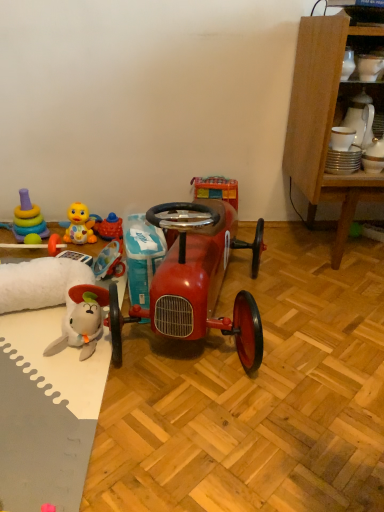
This screenshot has width=384, height=512. What are the coordinates of `stacked plastic rings at left, which ranks as the 5th toy in right-to-left order` in the screenshot? It's located at (27, 220).

What is the approximate width of rubber duck at lower left, the second toy in the left-to-right sequence?

It is 2.54 inches.

Find the location of a particular element. glossy red model car at center is located at coordinates (196, 281).

Where is `yellow rubber duck at left, which is the 3th toy from left to right`? yellow rubber duck at left, which is the 3th toy from left to right is located at coordinates (79, 225).

Measure the distance between white glossy mug at upper center, which is counted as the 5th toy, starting from the left, and camera.

The depth of white glossy mug at upper center, which is counted as the 5th toy, starting from the left, is 1.17 meters.

The width and height of the screenshot is (384, 512). I want to click on wooden cabinet at right, so click(x=328, y=119).

In order to click on stacked plastic rings at left, which ranks as the 5th toy in right-to-left order in this screenshot , I will do `click(27, 220)`.

From a real-world perspective, is stacked plastic rings at left, placed as the first toy when sorted from left to right, located higher than rubber duck at lower left, acting as the 4th toy starting from the right?

Yes, from a real-world perspective, stacked plastic rings at left, placed as the first toy when sorted from left to right, is on top of rubber duck at lower left, acting as the 4th toy starting from the right.

Consider the image. How different are the orientations of stacked plastic rings at left, which ranks as the 5th toy in right-to-left order, and rubber duck at lower left, acting as the 4th toy starting from the right, in degrees?

2.54 degrees.

Considering the positions of points (24, 188) and (30, 239), is point (24, 188) closer to camera compared to point (30, 239)?

That is False.

Is stacked plastic rings at left, placed as the first toy when sorted from left to right, aimed at rubber duck at lower left, the second toy in the left-to-right sequence?

Yes, stacked plastic rings at left, placed as the first toy when sorted from left to right, is oriented towards rubber duck at lower left, the second toy in the left-to-right sequence.

Considering the sizes of objects rubber duck at left, acting as the 2th toy starting from the right, and wooden cabinet at right in the image provided, who is shorter, rubber duck at left, acting as the 2th toy starting from the right, or wooden cabinet at right?

rubber duck at left, acting as the 2th toy starting from the right, is shorter.

Is point (119, 228) less distant than point (348, 211)?

No, (119, 228) is further to viewer.

Is wooden cabinet at right completely or partially inside rubber duck at left, acting as the 2th toy starting from the right?

No, wooden cabinet at right is not surrounded by rubber duck at left, acting as the 2th toy starting from the right.

Which of these two, rubber duck at left, acting as the 2th toy starting from the right, or wooden cabinet at right, is wider?

wooden cabinet at right.

Who is shorter, white glossy mug at upper center, which is counted as the 1th toy, starting from the right, or wooden cabinet at right?

white glossy mug at upper center, which is counted as the 1th toy, starting from the right.

Considering the relative positions of white glossy mug at upper center, which is counted as the 5th toy, starting from the left, and wooden cabinet at right in the image provided, is white glossy mug at upper center, which is counted as the 5th toy, starting from the left, to the right of wooden cabinet at right from the viewer's perspective?

No.

From the image's perspective, is white glossy mug at upper center, which is counted as the 5th toy, starting from the left, located above or below wooden cabinet at right?

Clearly, from the image's perspective, white glossy mug at upper center, which is counted as the 5th toy, starting from the left, is above wooden cabinet at right.

Considering the relative positions of yellow rubber duck at left, which is counted as the third toy, starting from the right, and rubber duck at lower left, acting as the 4th toy starting from the right, in the image provided, is yellow rubber duck at left, which is counted as the third toy, starting from the right, in front of rubber duck at lower left, acting as the 4th toy starting from the right,?

Yes, it is in front of rubber duck at lower left, acting as the 4th toy starting from the right.

From the image's perspective, which one is positioned higher, yellow rubber duck at left, which is the 3th toy from left to right, or rubber duck at lower left, acting as the 4th toy starting from the right?

yellow rubber duck at left, which is the 3th toy from left to right, appears higher in the image.

Looking at this image, is yellow rubber duck at left, which is counted as the third toy, starting from the right, bigger than rubber duck at lower left, acting as the 4th toy starting from the right?

Indeed, yellow rubber duck at left, which is counted as the third toy, starting from the right, has a larger size compared to rubber duck at lower left, acting as the 4th toy starting from the right.

From a real-world perspective, which is physically below, yellow rubber duck at left, which is the 3th toy from left to right, or rubber duck at lower left, acting as the 4th toy starting from the right?

From a 3D spatial view, rubber duck at lower left, acting as the 4th toy starting from the right, is below.

Is point (74, 217) in front of point (120, 229)?

No, (74, 217) is further to viewer.

Could you tell me if yellow rubber duck at left, which is the 3th toy from left to right, is turned towards rubber duck at left, which is the 4th toy from left to right?

No, yellow rubber duck at left, which is the 3th toy from left to right, is not turned towards rubber duck at left, which is the 4th toy from left to right.

From a real-world perspective, which is physically above, yellow rubber duck at left, which is counted as the third toy, starting from the right, or rubber duck at left, which is the 4th toy from left to right?

In real-world perspective, yellow rubber duck at left, which is counted as the third toy, starting from the right, is above.

From the picture: Which is in front, wooden cabinet at right or rubber duck at lower left, acting as the 4th toy starting from the right?

wooden cabinet at right.

Is wooden cabinet at right positioned beyond the bounds of rubber duck at lower left, acting as the 4th toy starting from the right?

wooden cabinet at right lies outside rubber duck at lower left, acting as the 4th toy starting from the right,'s area.

Does wooden cabinet at right have a lesser height compared to rubber duck at lower left, the second toy in the left-to-right sequence?

No, wooden cabinet at right is not shorter than rubber duck at lower left, the second toy in the left-to-right sequence.

Can you confirm if wooden cabinet at right is smaller than rubber duck at lower left, the second toy in the left-to-right sequence?

No, wooden cabinet at right is not smaller than rubber duck at lower left, the second toy in the left-to-right sequence.

Looking at this image, is white glossy mug at upper center, which is counted as the 5th toy, starting from the left, not within rubber duck at left, which is the 4th toy from left to right?

Yes, white glossy mug at upper center, which is counted as the 5th toy, starting from the left, is not within rubber duck at left, which is the 4th toy from left to right.

Is white glossy mug at upper center, which is counted as the 1th toy, starting from the right, aimed at rubber duck at left, which is the 4th toy from left to right?

No, white glossy mug at upper center, which is counted as the 1th toy, starting from the right, does not turn towards rubber duck at left, which is the 4th toy from left to right.

Could you measure the distance between white glossy mug at upper center, which is counted as the 5th toy, starting from the left, and rubber duck at left, which is the 4th toy from left to right?

39.06 inches.

Between white glossy mug at upper center, which is counted as the 1th toy, starting from the right, and rubber duck at left, acting as the 2th toy starting from the right, which one has smaller size?

With smaller size is white glossy mug at upper center, which is counted as the 1th toy, starting from the right.

From a real-world perspective, count 3rd toys upward from the rubber duck at lower left, the second toy in the left-to-right sequence, and point to it. Please provide its 2D coordinates.

[(27, 220)]

Where is `toy that is the 5th object located behind the wooden cabinet at right`? Image resolution: width=384 pixels, height=512 pixels. toy that is the 5th object located behind the wooden cabinet at right is located at coordinates (109, 227).

In the scene shown: Looking at the image, which one is located closer to stacked plastic rings at left, which ranks as the 5th toy in right-to-left order, yellow rubber duck at left, which is the 3th toy from left to right, or rubber duck at lower left, acting as the 4th toy starting from the right?

rubber duck at lower left, acting as the 4th toy starting from the right.

Looking at the image, which one is located closer to rubber duck at lower left, the second toy in the left-to-right sequence, wooden cabinet at right or yellow rubber duck at left, which is the 3th toy from left to right?

The object closer to rubber duck at lower left, the second toy in the left-to-right sequence, is yellow rubber duck at left, which is the 3th toy from left to right.

Estimate the real-world distances between objects in this image. Which object is closer to yellow rubber duck at left, which is the 3th toy from left to right, wooden cabinet at right or rubber duck at left, which is the 4th toy from left to right?

The object closer to yellow rubber duck at left, which is the 3th toy from left to right, is rubber duck at left, which is the 4th toy from left to right.

In the scene shown: From the image, which object appears to be farther from rubber duck at left, acting as the 2th toy starting from the right, stacked plastic rings at left, which ranks as the 5th toy in right-to-left order, or yellow rubber duck at left, which is the 3th toy from left to right?

stacked plastic rings at left, which ranks as the 5th toy in right-to-left order, is positioned further to the anchor rubber duck at left, acting as the 2th toy starting from the right.

From the image, which object appears to be farther from wooden cabinet at right, rubber duck at left, acting as the 2th toy starting from the right, or rubber duck at lower left, the second toy in the left-to-right sequence?

rubber duck at lower left, the second toy in the left-to-right sequence.

Based on their spatial positions, is rubber duck at lower left, the second toy in the left-to-right sequence, or yellow rubber duck at left, which is counted as the third toy, starting from the right, further from glossy red model car at center?

rubber duck at lower left, the second toy in the left-to-right sequence, lies further to glossy red model car at center than the other object.

Which object lies nearer to the anchor point stacked plastic rings at left, which ranks as the 5th toy in right-to-left order, glossy red model car at center or rubber duck at left, which is the 4th toy from left to right?

rubber duck at left, which is the 4th toy from left to right.

When comparing their distances from rubber duck at lower left, acting as the 4th toy starting from the right, does yellow rubber duck at left, which is the 3th toy from left to right, or rubber duck at left, which is the 4th toy from left to right, seem closer?

yellow rubber duck at left, which is the 3th toy from left to right, lies closer to rubber duck at lower left, acting as the 4th toy starting from the right, than the other object.

I want to click on toy between stacked plastic rings at left, which ranks as the 5th toy in right-to-left order, and yellow rubber duck at left, which is the 3th toy from left to right, so (32, 239).

Where is `model car between rubber duck at left, which is the 4th toy from left to right, and white glossy mug at upper center, which is counted as the 1th toy, starting from the right`? The height and width of the screenshot is (512, 384). model car between rubber duck at left, which is the 4th toy from left to right, and white glossy mug at upper center, which is counted as the 1th toy, starting from the right is located at coordinates (196, 281).

The height and width of the screenshot is (512, 384). Identify the location of toy situated between yellow rubber duck at left, which is the 3th toy from left to right, and white glossy mug at upper center, which is counted as the 1th toy, starting from the right, from left to right. (109, 227).

At what (x,y) coordinates should I click in order to perform the action: click on model car between stacked plastic rings at left, which ranks as the 5th toy in right-to-left order, and white glossy mug at upper center, which is counted as the 1th toy, starting from the right, in the horizontal direction. Please return your answer as a coordinate pair (x, y). Looking at the image, I should click on [x=196, y=281].